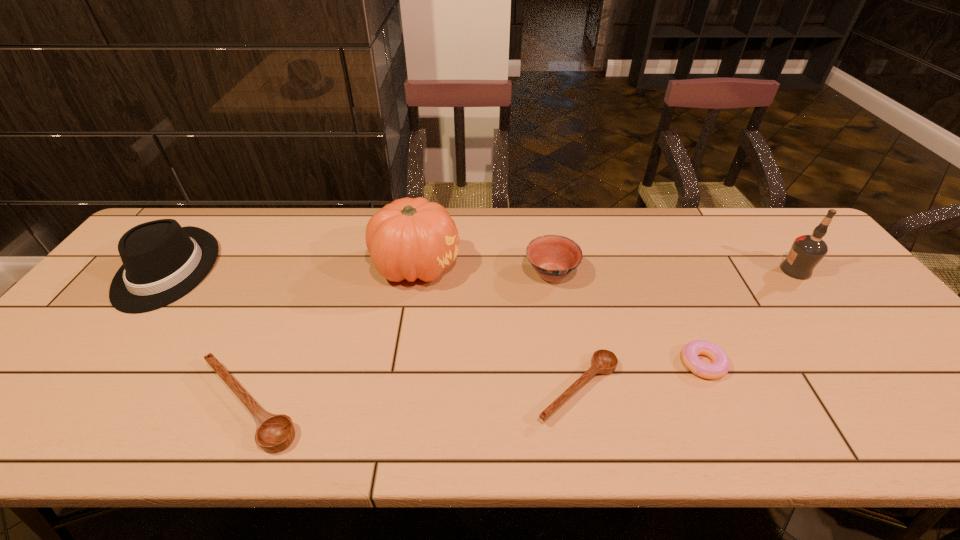
Considering the uniform spacing of wooden spoons, where should an additional wooden spoon be positioned on the right? Please locate a free spot. Please provide its 2D coordinates. Your answer should be formatted as a tuple, i.e. [(x, y)], where the tuple contains the x and y coordinates of a point satisfying the conditions above.

[(889, 374)]